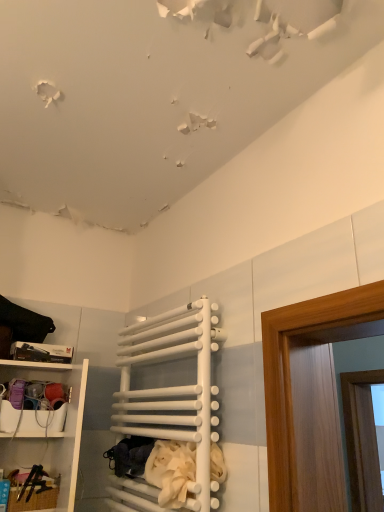
Question: From the image's perspective, would you say white plastic shelf at lower left is positioned over white matte towel rack at center?

Choices:
 (A) no
 (B) yes

Answer: (A)

Question: Could you tell me if white plastic shelf at lower left is turned towards white matte towel rack at center?

Choices:
 (A) yes
 (B) no

Answer: (B)

Question: Is white plastic shelf at lower left thinner than white matte towel rack at center?

Choices:
 (A) yes
 (B) no

Answer: (B)

Question: Is white plastic shelf at lower left far away from white matte towel rack at center?

Choices:
 (A) yes
 (B) no

Answer: (B)

Question: Is white plastic shelf at lower left outside of white matte towel rack at center?

Choices:
 (A) yes
 (B) no

Answer: (A)

Question: Is beige fabric laundry at lower center wider or thinner than white plastic shelf at lower left?

Choices:
 (A) wide
 (B) thin

Answer: (B)

Question: Considering the relative positions of beige fabric laundry at lower center and white plastic shelf at lower left in the image provided, is beige fabric laundry at lower center to the left or to the right of white plastic shelf at lower left?

Choices:
 (A) left
 (B) right

Answer: (B)

Question: Considering the positions of beige fabric laundry at lower center and white plastic shelf at lower left in the image, is beige fabric laundry at lower center taller or shorter than white plastic shelf at lower left?

Choices:
 (A) short
 (B) tall

Answer: (A)

Question: Considering the positions of point (180, 476) and point (29, 373), is point (180, 476) closer or farther from the camera than point (29, 373)?

Choices:
 (A) closer
 (B) farther

Answer: (A)

Question: Is white matte towel rack at center wider or thinner than beige fabric laundry at lower center?

Choices:
 (A) thin
 (B) wide

Answer: (A)

Question: Is white matte towel rack at center inside the boundaries of beige fabric laundry at lower center, or outside?

Choices:
 (A) outside
 (B) inside

Answer: (A)

Question: From a real-world perspective, is white matte towel rack at center above or below beige fabric laundry at lower center?

Choices:
 (A) above
 (B) below

Answer: (A)

Question: Does point (148, 361) appear closer or farther from the camera than point (180, 498)?

Choices:
 (A) farther
 (B) closer

Answer: (A)

Question: From the image's perspective, is white plastic shelf at lower left positioned above or below white matte towel rack at center?

Choices:
 (A) above
 (B) below

Answer: (B)

Question: From a real-world perspective, is white plastic shelf at lower left positioned above or below white matte towel rack at center?

Choices:
 (A) below
 (B) above

Answer: (A)